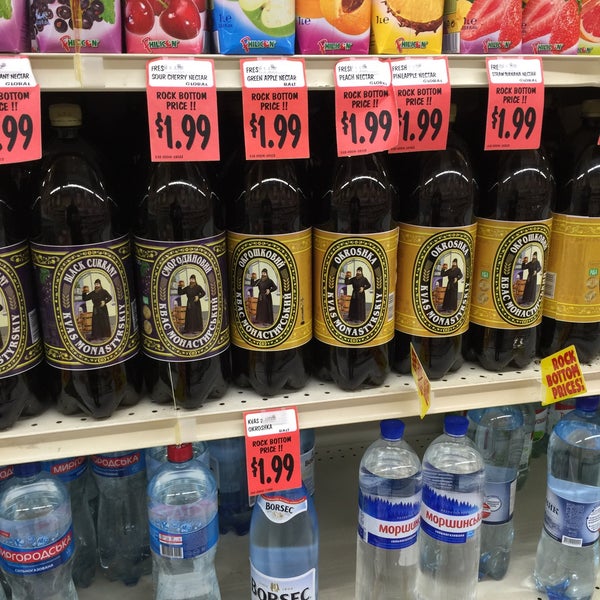
The image size is (600, 600). I want to click on bottle, so click(x=577, y=567).